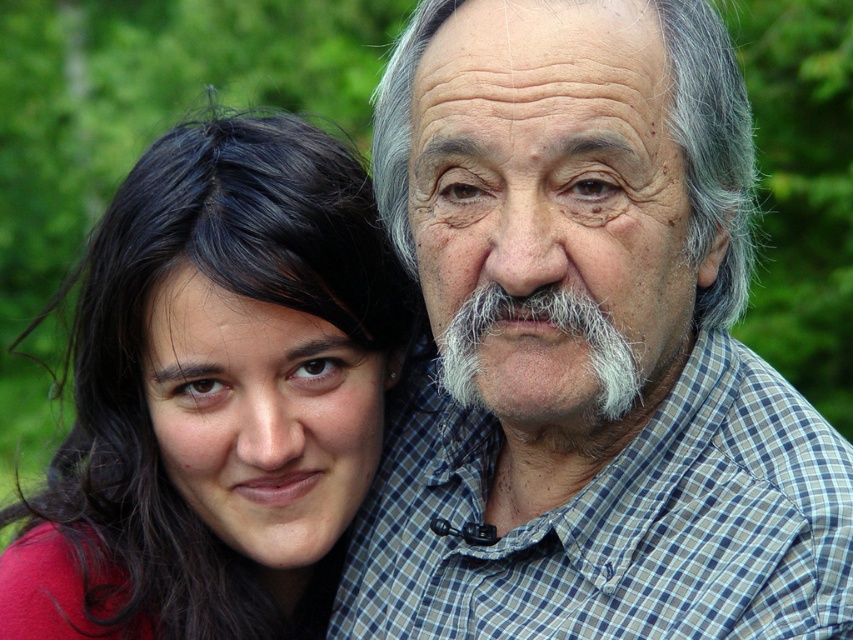
Question: Which object is farther from the camera taking this photo?

Choices:
 (A) matte black hair at left
 (B) gray checkered shirt at upper right
 (C) white fuzzy beard at center

Answer: (A)

Question: Can you confirm if gray checkered shirt at upper right is bigger than matte black hair at left?

Choices:
 (A) no
 (B) yes

Answer: (B)

Question: Is matte black hair at left behind white fuzzy beard at center?

Choices:
 (A) no
 (B) yes

Answer: (B)

Question: Which point is closer to the camera?

Choices:
 (A) (538, 304)
 (B) (531, 152)

Answer: (B)

Question: Is matte black hair at left wider than white fuzzy beard at center?

Choices:
 (A) yes
 (B) no

Answer: (A)

Question: Which object appears closest to the camera in this image?

Choices:
 (A) white fuzzy beard at center
 (B) gray checkered shirt at upper right
 (C) gray/textured hair at upper center

Answer: (B)